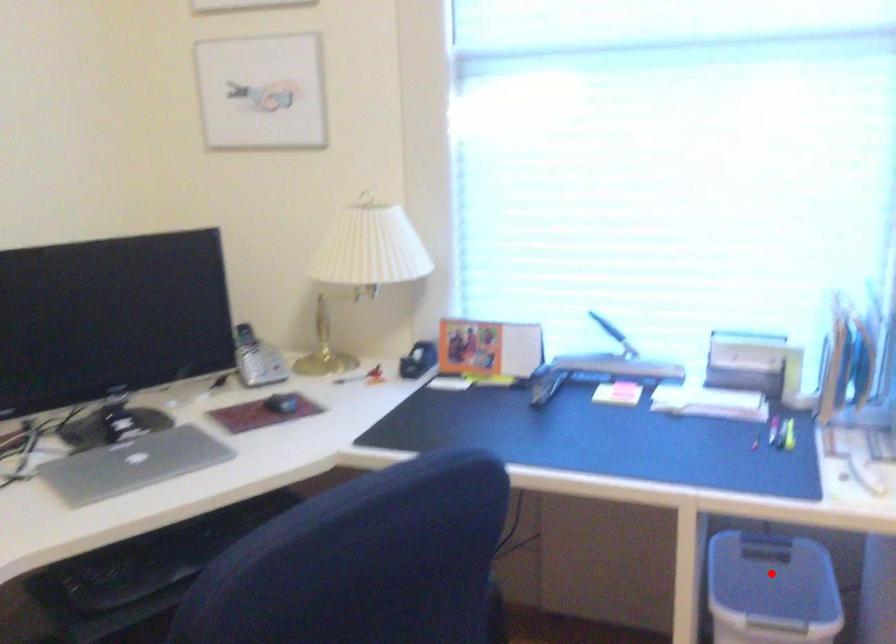
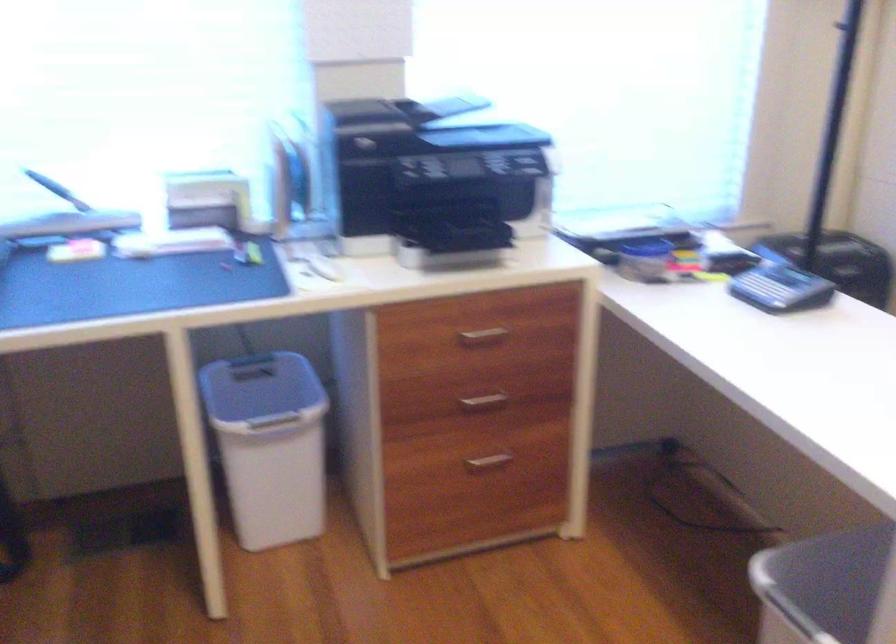
In the second image, find the point that corresponds to the highlighted location in the first image.

(261, 390)